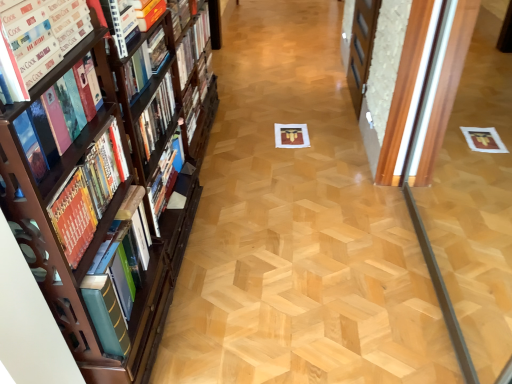
Find the location of a particular element. The height and width of the screenshot is (384, 512). hardcover book at upper left, positioned as the fifth book in front-to-back order is located at coordinates (145, 63).

This screenshot has width=512, height=384. What do you see at coordinates (145, 63) in the screenshot?
I see `hardcover book at upper left, positioned as the fifth book in front-to-back order` at bounding box center [145, 63].

Describe the element at coordinates (193, 45) in the screenshot. I see `hardcover book at upper center, positioned as the first book in back-to-front order` at that location.

What is the approximate height of hardcover book at upper center, positioned as the first book in back-to-front order?

7.75 inches.

Describe the element at coordinates (57, 119) in the screenshot. I see `hardcover book at left, which is counted as the 4th book, starting from the back` at that location.

Locate an element on the screen. This screenshot has height=384, width=512. hardcover book at upper left, positioned as the fifth book in front-to-back order is located at coordinates (145, 63).

Identify the location of the 5th book positioned above the wooden screen door at right (from a real-world perspective). (57, 119).

From the image's perspective, between hardcover book at left, which is counted as the 4th book, starting from the back, and wooden screen door at right, who is located below?

hardcover book at left, which is counted as the 4th book, starting from the back, appears lower in the image.

Based on the photo, who is shorter, hardcover book at left, placed as the 3th book when sorted from front to back, or wooden screen door at right?

With less height is hardcover book at left, placed as the 3th book when sorted from front to back.

Is hardcover book at left, which is counted as the 4th book, starting from the back, positioned with its back to wooden screen door at right?

No, hardcover book at left, which is counted as the 4th book, starting from the back, is not facing the opposite direction of wooden screen door at right.

Which of these two, hardcover book at upper center, acting as the 6th book starting from the front, or wooden screen door at right, stands taller?

With more height is wooden screen door at right.

Can we say hardcover book at upper center, positioned as the first book in back-to-front order, lies outside wooden screen door at right?

Yes, hardcover book at upper center, positioned as the first book in back-to-front order, is located beyond the bounds of wooden screen door at right.

Can you see hardcover book at upper center, positioned as the first book in back-to-front order, touching wooden screen door at right?

hardcover book at upper center, positioned as the first book in back-to-front order, and wooden screen door at right are clearly separated.

Considering the positions of objects hardcover book at upper center, acting as the 6th book starting from the front, and wooden screen door at right in the image provided, who is more to the right, hardcover book at upper center, acting as the 6th book starting from the front, or wooden screen door at right?

From the viewer's perspective, wooden screen door at right appears more on the right side.

Is hardcover book at upper center, acting as the 6th book starting from the front, in front of or behind matte hardcover book at left, which is the second book in front-to-back order, in the image?

Clearly, hardcover book at upper center, acting as the 6th book starting from the front, is behind matte hardcover book at left, which is the second book in front-to-back order.

Between point (187, 64) and point (68, 3), which one is positioned behind?

Point (187, 64)

Which is more to the right, hardcover book at upper center, acting as the 6th book starting from the front, or matte hardcover book at left, which is the second book in front-to-back order?

hardcover book at upper center, acting as the 6th book starting from the front.

Does hardcover book at left, which appears as the first book when viewed from the front, have a larger size compared to hardcover book at left, placed as the 3th book when sorted from front to back?

Correct, hardcover book at left, which appears as the first book when viewed from the front, is larger in size than hardcover book at left, placed as the 3th book when sorted from front to back.

Is hardcover book at left, which appears as the first book when viewed from the front, facing towards hardcover book at left, which is counted as the 4th book, starting from the back?

Yes, hardcover book at left, which appears as the first book when viewed from the front, is facing hardcover book at left, which is counted as the 4th book, starting from the back.

From the picture: Is hardcover book at left, which is the 6th book from back to front, situated inside hardcover book at left, placed as the 3th book when sorted from front to back, or outside?

hardcover book at left, which is the 6th book from back to front, is located beyond the bounds of hardcover book at left, placed as the 3th book when sorted from front to back.

From a real-world perspective, between hardcover book at left, which appears as the first book when viewed from the front, and hardcover book at left, which is counted as the 4th book, starting from the back, who is vertically higher?

From a 3D spatial view, hardcover book at left, which is counted as the 4th book, starting from the back, is above.

Does point (92, 193) come behind point (198, 42)?

No.

Is hardcover book at left, which is the 4th book from front to back, next to hardcover book at upper center, positioned as the first book in back-to-front order?

No, hardcover book at left, which is the 4th book from front to back, is not making contact with hardcover book at upper center, positioned as the first book in back-to-front order.

Can we say hardcover book at left, which is the 4th book from front to back, lies outside hardcover book at upper center, acting as the 6th book starting from the front?

Yes.

Does point (115, 179) appear closer or farther from the camera than point (159, 46)?

Clearly, point (115, 179) is closer to the camera than point (159, 46).

Consider the image. From the image's perspective, does hardcover book at left, the third book viewed from the back, appear higher than hardcover book at upper left, the second book positioned from the back?

No, from the image's perspective, hardcover book at left, the third book viewed from the back, is not over hardcover book at upper left, the second book positioned from the back.

Between hardcover book at left, the third book viewed from the back, and hardcover book at upper left, positioned as the fifth book in front-to-back order, which one has smaller size?

Smaller between the two is hardcover book at upper left, positioned as the fifth book in front-to-back order.

Which of these two, hardcover book at left, which is the 4th book from front to back, or hardcover book at upper left, the second book positioned from the back, stands taller?

hardcover book at left, which is the 4th book from front to back.

From the image's perspective, which one is positioned lower, hardcover book at left, placed as the 3th book when sorted from front to back, or hardcover book at left, which is the 6th book from back to front?

hardcover book at left, which is the 6th book from back to front.

Considering the relative sizes of hardcover book at left, which is counted as the 4th book, starting from the back, and hardcover book at left, which is the 6th book from back to front, in the image provided, is hardcover book at left, which is counted as the 4th book, starting from the back, shorter than hardcover book at left, which is the 6th book from back to front,?

Yes, hardcover book at left, which is counted as the 4th book, starting from the back, is shorter than hardcover book at left, which is the 6th book from back to front.

Does point (40, 158) come behind point (111, 318)?

No, it is not.

You are a GUI agent. You are given a task and a screenshot of the screen. Output one action in this format:
    pyautogui.click(x=<x>, y=<y>)
    Task: Click on the 1st book counting from the right of the hardcover book at left, which is the 6th book from back to front
    
    Given the screenshot: What is the action you would take?
    pyautogui.click(x=57, y=119)

The height and width of the screenshot is (384, 512). I want to click on screen door that appears behind the hardcover book at left, placed as the 3th book when sorted from front to back, so click(361, 48).

You are a GUI agent. You are given a task and a screenshot of the screen. Output one action in this format:
    pyautogui.click(x=<x>, y=<y>)
    Task: Click on the screen door that is above the hardcover book at upper center, positioned as the first book in back-to-front order (from the image's perspective)
    This screenshot has width=512, height=384.
    Given the screenshot: What is the action you would take?
    pyautogui.click(x=361, y=48)

Based on their spatial positions, is hardcover book at left, which is the 6th book from back to front, or hardcover book at left, the third book viewed from the back, closer to matte hardcover book at left, marked as the fifth book in a back-to-front arrangement?

hardcover book at left, the third book viewed from the back, is positioned closer to the anchor matte hardcover book at left, marked as the fifth book in a back-to-front arrangement.

From the image, which object appears to be farther from hardcover book at upper center, acting as the 6th book starting from the front, wooden screen door at right or hardcover book at left, which is the 6th book from back to front?

Based on the image, wooden screen door at right appears to be further to hardcover book at upper center, acting as the 6th book starting from the front.

Estimate the real-world distances between objects in this image. Which object is further from hardcover book at left, which is counted as the 4th book, starting from the back, hardcover book at left, which appears as the first book when viewed from the front, or hardcover book at upper left, the second book positioned from the back?

Among the two, hardcover book at upper left, the second book positioned from the back, is located further to hardcover book at left, which is counted as the 4th book, starting from the back.

When comparing their distances from hardcover book at left, which is the 6th book from back to front, does hardcover book at left, which is the 4th book from front to back, or hardcover book at left, placed as the 3th book when sorted from front to back, seem further?

hardcover book at left, placed as the 3th book when sorted from front to back, is positioned further to the anchor hardcover book at left, which is the 6th book from back to front.

Consider the image. Estimate the real-world distances between objects in this image. Which object is further from wooden screen door at right, hardcover book at upper left, the second book positioned from the back, or hardcover book at upper center, acting as the 6th book starting from the front?

Among the two, hardcover book at upper left, the second book positioned from the back, is located further to wooden screen door at right.

Estimate the real-world distances between objects in this image. Which object is further from matte hardcover book at left, marked as the fifth book in a back-to-front arrangement, wooden screen door at right or hardcover book at left, which appears as the first book when viewed from the front?

wooden screen door at right is further to matte hardcover book at left, marked as the fifth book in a back-to-front arrangement.

Estimate the real-world distances between objects in this image. Which object is closer to hardcover book at left, which is the 6th book from back to front, hardcover book at upper center, acting as the 6th book starting from the front, or hardcover book at upper left, positioned as the fifth book in front-to-back order?

hardcover book at upper left, positioned as the fifth book in front-to-back order.

Considering their positions, is wooden screen door at right positioned closer to matte hardcover book at left, which is the second book in front-to-back order, than hardcover book at left, placed as the 3th book when sorted from front to back?

hardcover book at left, placed as the 3th book when sorted from front to back, is positioned closer to the anchor matte hardcover book at left, which is the second book in front-to-back order.

Where is `book that lies between matte hardcover book at left, marked as the fifth book in a back-to-front arrangement, and hardcover book at left, the third book viewed from the back, from top to bottom`? book that lies between matte hardcover book at left, marked as the fifth book in a back-to-front arrangement, and hardcover book at left, the third book viewed from the back, from top to bottom is located at coordinates (57, 119).

What are the coordinates of `book situated between hardcover book at upper left, the second book positioned from the back, and wooden screen door at right from left to right` in the screenshot? It's located at (193, 45).

What are the coordinates of `book between hardcover book at left, which is the 4th book from front to back, and hardcover book at upper center, acting as the 6th book starting from the front, from front to back` in the screenshot? It's located at pyautogui.click(x=145, y=63).

At what (x,y) coordinates should I click in order to perform the action: click on book between hardcover book at left, placed as the 3th book when sorted from front to back, and hardcover book at upper left, positioned as the fifth book in front-to-back order, along the z-axis. Please return your answer as a coordinate pair (x, y). The height and width of the screenshot is (384, 512). Looking at the image, I should click on (88, 193).